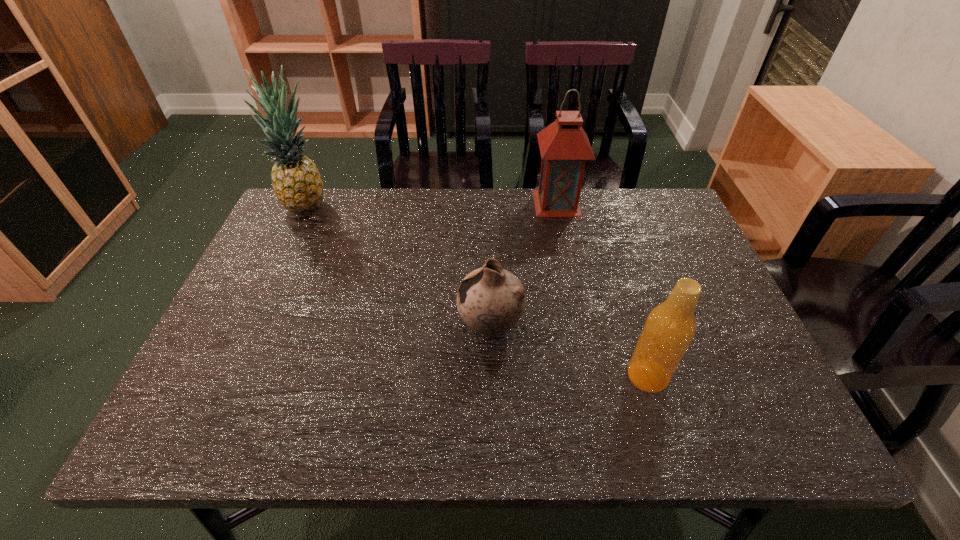
Identify the location of the leftmost object. (297, 184).

Locate an element on the screen. lantern is located at coordinates (564, 146).

In order to click on the nearest object in this screenshot , I will do `click(670, 327)`.

The height and width of the screenshot is (540, 960). I want to click on beer bottle, so click(x=670, y=327).

Identify the location of the second object from left to right. (491, 300).

The height and width of the screenshot is (540, 960). I want to click on pottery, so click(x=491, y=300).

Identify the location of free space located 0.270m on the right of the pineapple. coord(418,206).

Identify the location of vacant space located on the front of the lantern. pyautogui.click(x=582, y=323).

I want to click on vacant area located on the back of the nearest object, so click(x=614, y=269).

Locate an element on the screen. Image resolution: width=960 pixels, height=540 pixels. free space located 0.340m from the spout of the shortest object is located at coordinates (310, 326).